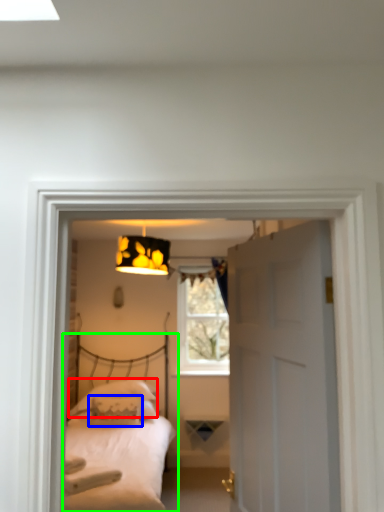
Question: Based on their relative distances, which object is nearer to pillow (highlighted by a red box)? Choose from pillow (highlighted by a blue box) and bed (highlighted by a green box).

Choices:
 (A) pillow
 (B) bed

Answer: (A)